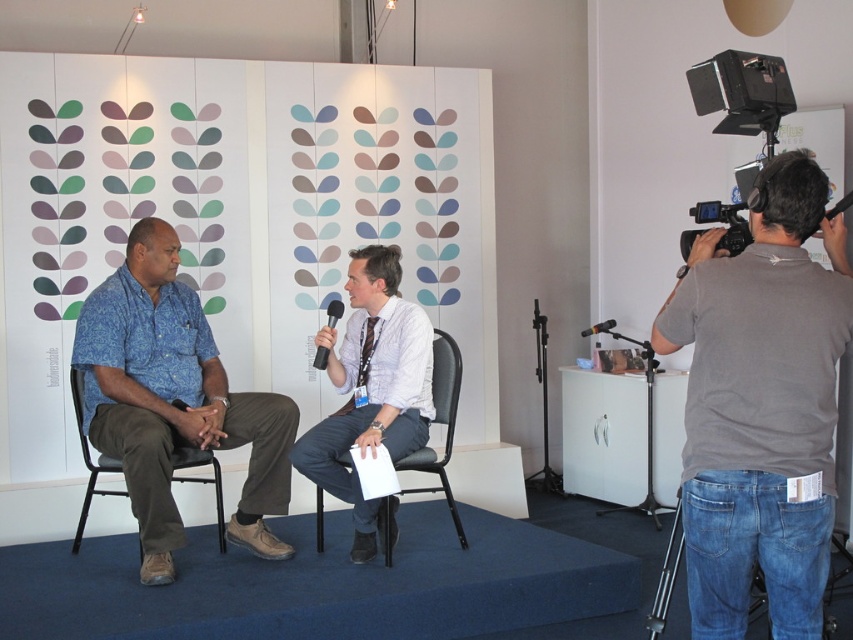
This screenshot has width=853, height=640. What do you see at coordinates (173, 401) in the screenshot? I see `blue printed shirt at left` at bounding box center [173, 401].

In order to click on blue printed shirt at left in this screenshot , I will do `click(173, 401)`.

Is point (172, 328) farther from viewer compared to point (436, 381)?

No, (172, 328) is in front of (436, 381).

The height and width of the screenshot is (640, 853). Find the location of `blue printed shirt at left`. blue printed shirt at left is located at coordinates (173, 401).

Which is more to the right, metallic black chair at left or black matte microphone at upper right?

black matte microphone at upper right is more to the right.

Which is more to the left, metallic black chair at left or black matte microphone at upper right?

metallic black chair at left

What do you see at coordinates (90, 458) in the screenshot? I see `metallic black chair at left` at bounding box center [90, 458].

This screenshot has height=640, width=853. What are the coordinates of `metallic black chair at left` in the screenshot? It's located at (90, 458).

Does point (199, 464) come farther from viewer compared to point (328, 326)?

No, (199, 464) is closer to viewer.

Between point (219, 518) and point (332, 323), which one is positioned in front?

Point (219, 518)

Locate an element on the screen. The image size is (853, 640). metallic black chair at left is located at coordinates (90, 458).